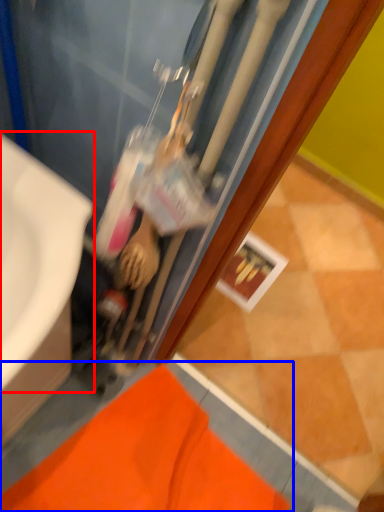
Question: Among these objects, which one is farthest to the camera, sink (highlighted by a red box) or bath mat (highlighted by a blue box)?

Choices:
 (A) sink
 (B) bath mat

Answer: (B)